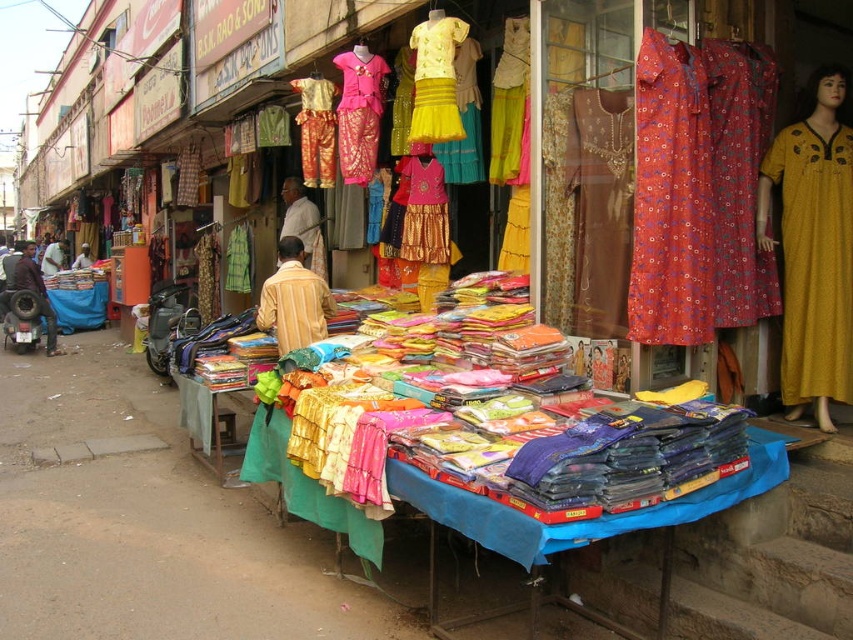
Question: Based on their relative distances, which object is farther from the yellow printed dress at right?

Choices:
 (A) matte yellow fabric at center
 (B) yellow satin dress at center

Answer: (A)

Question: Is shiny pink fabric dress at center bigger than matte yellow dress at center?

Choices:
 (A) yes
 (B) no

Answer: (B)

Question: Does light brown fabric shirt at center come behind green fabric at center?

Choices:
 (A) no
 (B) yes

Answer: (A)

Question: Which of the following is the closest to the observer?

Choices:
 (A) matte yellow dress at center
 (B) matte black jacket at left

Answer: (B)

Question: Which point is farther to the camera?

Choices:
 (A) matte yellow dress at center
 (B) shiny gold fabric dress at center
 (C) green fabric at center
 (D) shiny gold skirt at center

Answer: (A)

Question: Is shiny gold fabric dress at center in front of matte yellow fabric at center?

Choices:
 (A) no
 (B) yes

Answer: (B)